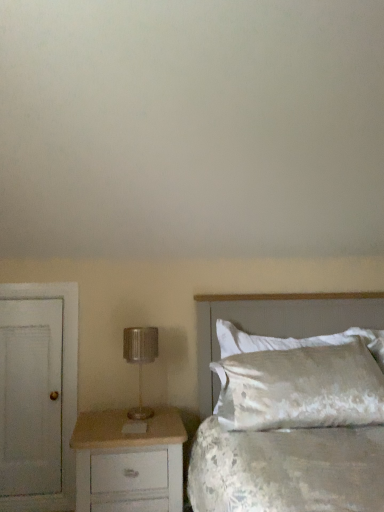
Identify the location of free location in front of metallic silver lamp at left. (132, 423).